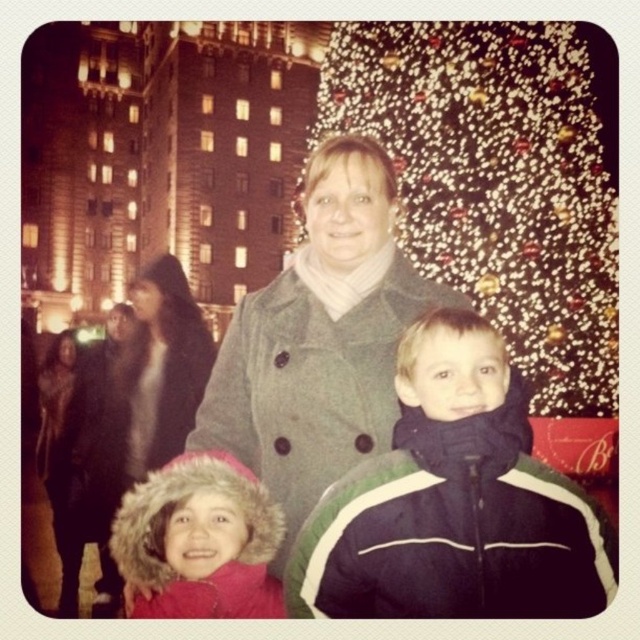
Does green and white jacket at center come in front of fuzzy pink coat at lower left?

Yes, it is in front of fuzzy pink coat at lower left.

Between green and white jacket at center and fuzzy pink coat at lower left, which one is positioned lower?

fuzzy pink coat at lower left is lower down.

Between point (461, 520) and point (273, 577), which one is positioned behind?

The point (273, 577) is behind.

Where is `green and white jacket at center`? This screenshot has height=640, width=640. green and white jacket at center is located at coordinates (452, 502).

Which is more to the right, gray wool coat at center or matte gray coat at center?

Positioned to the right is matte gray coat at center.

Consider the image. Which is more to the left, gray wool coat at center or matte gray coat at center?

Positioned to the left is gray wool coat at center.

The width and height of the screenshot is (640, 640). Identify the location of gray wool coat at center. (321, 339).

Which is above, matte gray coat at center or black fur coat at left?

matte gray coat at center

Is point (273, 294) positioned in front of point (104, 573)?

Yes, it is.

Measure the distance between point (304, 216) and camera.

Point (304, 216) and camera are 85.70 meters apart from each other.

Where is `matte gray coat at center`? The image size is (640, 640). matte gray coat at center is located at coordinates (321, 337).